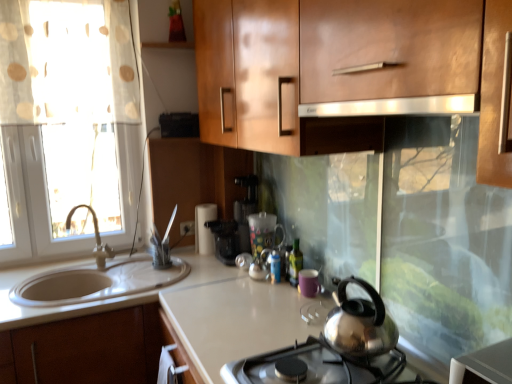
What are the coordinates of `free spot in front of purple matte mug at center, placed as the 1th appliance when sorted from right to left` in the screenshot? It's located at (304, 312).